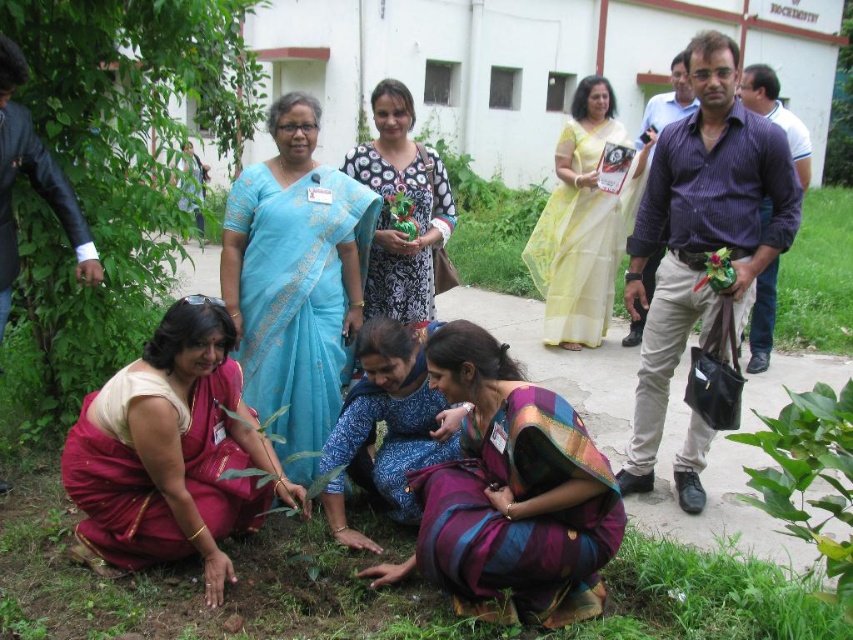
Which of these two, purple striped shirt at center or blue silk saree at center, stands taller?

Standing taller between the two is purple striped shirt at center.

Can you confirm if purple striped shirt at center is taller than blue silk saree at center?

Correct, purple striped shirt at center is much taller as blue silk saree at center.

Who is more forward, (717, 172) or (260, 179)?

Point (717, 172) is in front.

The width and height of the screenshot is (853, 640). In order to click on purple striped shirt at center in this screenshot , I will do `click(701, 230)`.

This screenshot has height=640, width=853. What do you see at coordinates (294, 280) in the screenshot? I see `blue silk saree at center` at bounding box center [294, 280].

Between blue silk saree at center and blue printed fabric at center, which one is positioned higher?

Positioned higher is blue silk saree at center.

Which is in front, point (247, 176) or point (434, 429)?

Point (434, 429) is in front.

Where is `blue silk saree at center`? The image size is (853, 640). blue silk saree at center is located at coordinates (294, 280).

Does purple silk saree at lower center have a greater width compared to blue silk saree at center?

Indeed, purple silk saree at lower center has a greater width compared to blue silk saree at center.

Does point (523, 408) come behind point (265, 244)?

No, (523, 408) is closer to viewer.

You are a GUI agent. You are given a task and a screenshot of the screen. Output one action in this format:
    pyautogui.click(x=<x>, y=<y>)
    Task: Click on the purple silk saree at lower center
    The height and width of the screenshot is (640, 853).
    Given the screenshot: What is the action you would take?
    pyautogui.click(x=509, y=493)